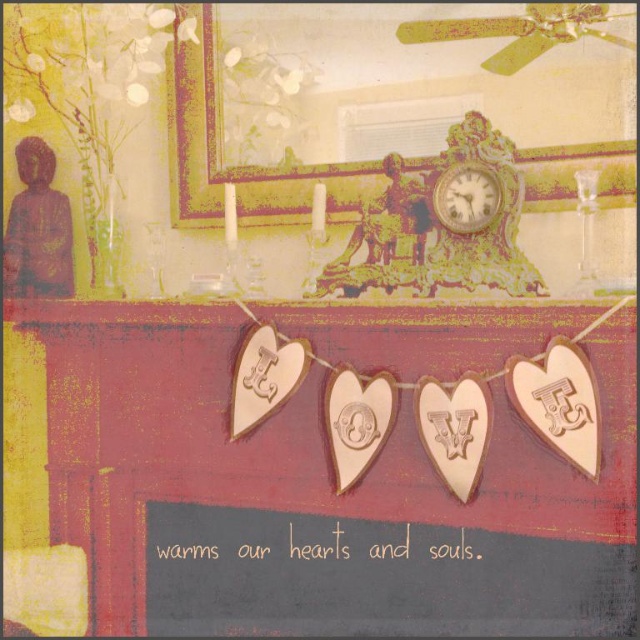
You are an interior designer who wants to ensure that the wooden hearts at center and the metallic gold picture frame at upper center are spaced at least 18 inches apart for aesthetic balance. Based on the current setup, is the spacing between them sufficient?

The wooden hearts at center and the metallic gold picture frame at upper center are currently 17.18 inches apart, which is slightly less than the desired 18 inches. Therefore, the spacing between them is not sufficient for the required aesthetic balance.

You are an interior designer planning to add a new wall decor item that is 12 inches wide. You see the metallic gold picture frame at upper center and the gold textured clock at upper center. Can you fit the new item between them without overlapping?

The metallic gold picture frame at upper center is 11.39 inches away from the gold textured clock at upper center. Since the new item is 12 inches wide, it cannot fit between them without overlapping as the space is slightly smaller than the item.

In the scene shown: You are an interior designer planning to add a new shelf between the wooden hearts at center and the gold textured clock at upper center. The shelf you have in mind is 18 inches long. Will there be enough space to fit it?

The distance between the wooden hearts at center and the gold textured clock at upper center is 19.30 inches. Since the shelf is 18 inches long, there is sufficient space to fit it between them.